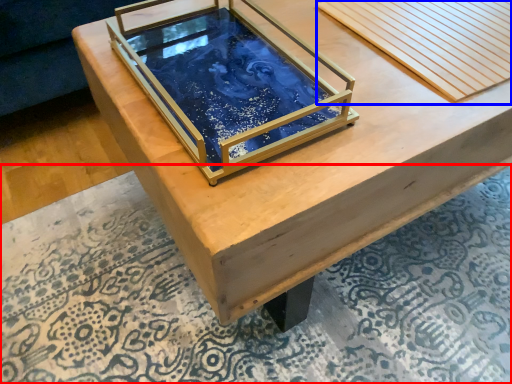
Question: Which object is further to the camera taking this photo, mat (highlighted by a red box) or plank (highlighted by a blue box)?

Choices:
 (A) mat
 (B) plank

Answer: (B)